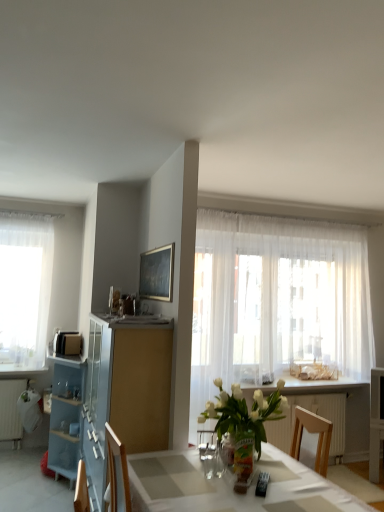
Locate an element on the screen. Image resolution: width=384 pixels, height=512 pixels. vacant space in front of clear glass vase at center is located at coordinates coord(255,486).